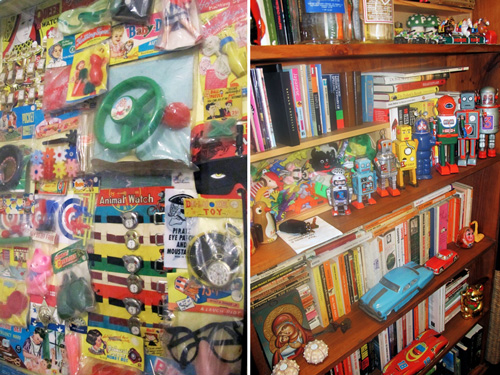
Locate an element on the screen. The width and height of the screenshot is (500, 375). shelf is located at coordinates (379, 219), (372, 332).